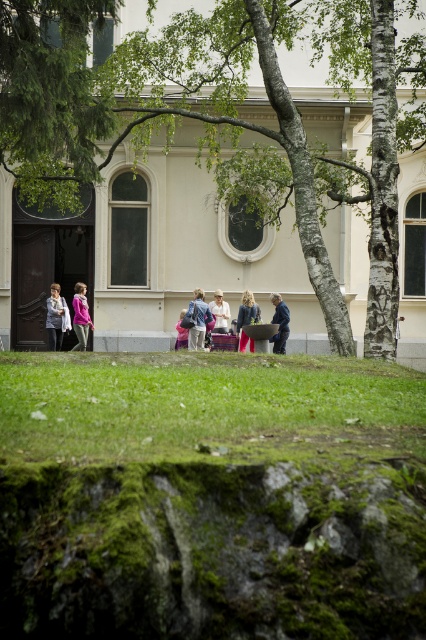
Which is above, pink fabric jacket at center or matte white shirt at center?

matte white shirt at center

Who is taller, pink fabric jacket at center or matte white shirt at center?

With more height is pink fabric jacket at center.

Measure the distance between point (78, 326) and camera.

The distance of point (78, 326) from camera is 80.17 feet.

The height and width of the screenshot is (640, 426). I want to click on pink fabric jacket at center, so click(x=80, y=316).

You are a GUI agent. You are given a task and a screenshot of the screen. Output one action in this format:
    pyautogui.click(x=<x>, y=<y>)
    Task: Click on the green leafy tree at upper left
    This screenshot has width=426, height=640.
    Given the screenshot: What is the action you would take?
    pyautogui.click(x=51, y=97)

Describe the element at coordinates (51, 97) in the screenshot. I see `green leafy tree at upper left` at that location.

The width and height of the screenshot is (426, 640). Describe the element at coordinates (51, 97) in the screenshot. I see `green leafy tree at upper left` at that location.

The image size is (426, 640). I want to click on green leafy tree at upper left, so click(51, 97).

Who is lower down, green grass at lower center or matte blue backpack at center?

green grass at lower center is lower down.

Which is more to the right, green grass at lower center or matte blue backpack at center?

Positioned to the right is green grass at lower center.

Where is `green grass at lower center`? The image size is (426, 640). green grass at lower center is located at coordinates (203, 404).

Where is `green grass at lower center`? The image size is (426, 640). green grass at lower center is located at coordinates (203, 404).